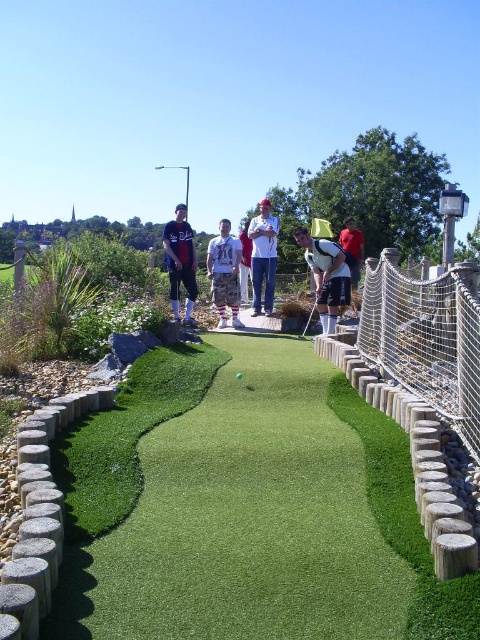
Does matte black shirt at center have a greater width compared to green rubber golf ball at center?

Yes, matte black shirt at center is wider than green rubber golf ball at center.

Is point (177, 212) positioned behind point (236, 376)?

Yes, point (177, 212) is farther from viewer.

The image size is (480, 640). I want to click on matte black shirt at center, so click(x=180, y=262).

Does matte black shirt at center have a greater width compared to camo pants at center?

Indeed, matte black shirt at center has a greater width compared to camo pants at center.

This screenshot has width=480, height=640. Describe the element at coordinates (180, 262) in the screenshot. I see `matte black shirt at center` at that location.

Where is `matte black shirt at center`? The width and height of the screenshot is (480, 640). matte black shirt at center is located at coordinates coord(180,262).

Which is more to the right, green artificial turf at center or green rubber golf ball at center?

green artificial turf at center is more to the right.

Which is below, green artificial turf at center or green rubber golf ball at center?

Positioned lower is green artificial turf at center.

What are the coordinates of `green artificial turf at center` in the screenshot? It's located at (245, 509).